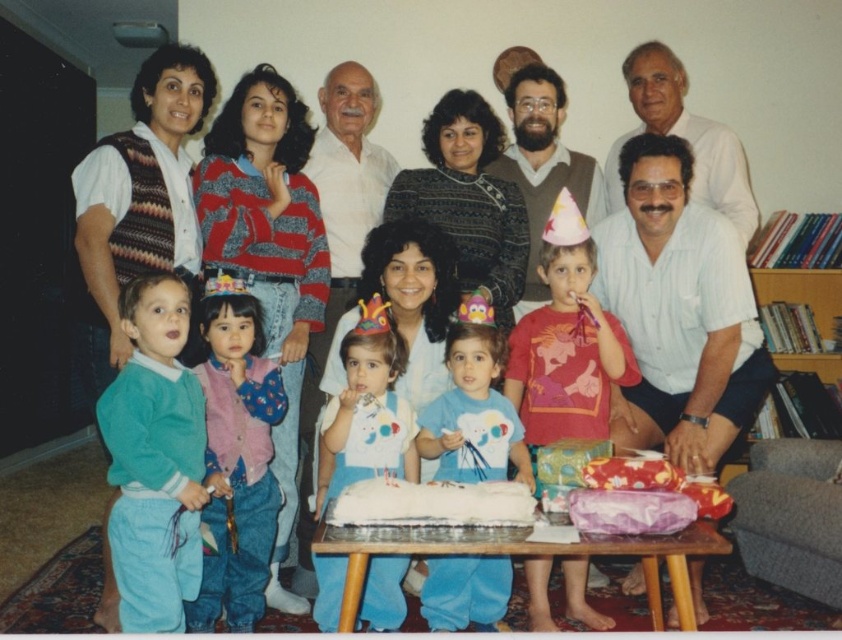
Question: Does fluffy pink vest at center have a lesser width compared to red cotton shirt at center?

Choices:
 (A) no
 (B) yes

Answer: (B)

Question: Is fluffy pink vest at center wider than blue cotton shirt at center?

Choices:
 (A) yes
 (B) no

Answer: (B)

Question: Which of these objects is positioned farthest from the fluffy pink vest at center?

Choices:
 (A) white matte bib at center
 (B) blue cotton shirt at center
 (C) red cotton shirt at center

Answer: (C)

Question: Can you confirm if red cotton shirt at center is wider than blue cotton shirt at center?

Choices:
 (A) no
 (B) yes

Answer: (B)

Question: Based on their relative distances, which object is nearer to the white matte bib at center?

Choices:
 (A) red cotton shirt at center
 (B) teal fleece sweater at left
 (C) blue cotton shirt at center

Answer: (C)

Question: Which object is the farthest from the white matte bib at center?

Choices:
 (A) fluffy pink vest at center
 (B) white frosted cake at center
 (C) blue cotton shirt at center
 (D) red cotton shirt at center

Answer: (B)